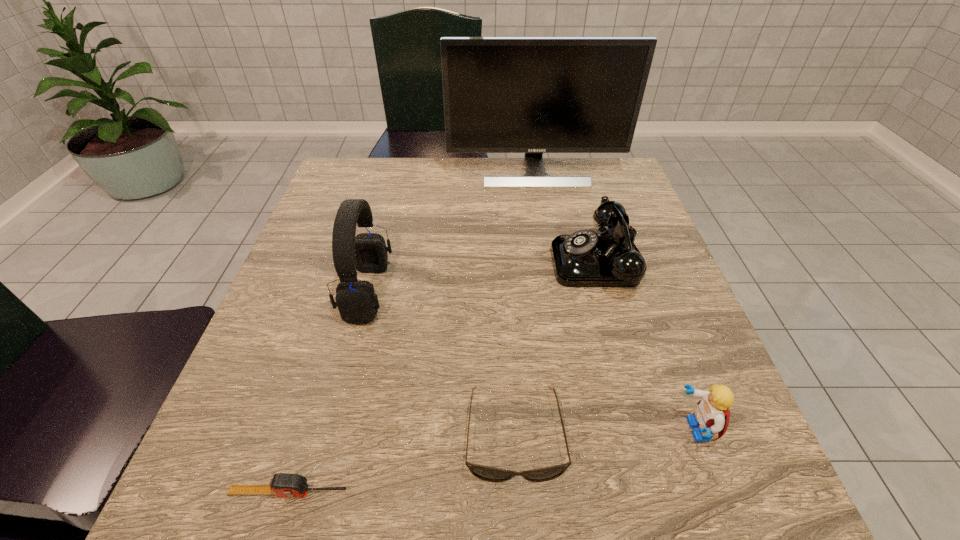
This screenshot has height=540, width=960. I want to click on tape measure that is at the left edge, so click(282, 484).

The height and width of the screenshot is (540, 960). I want to click on monitor present at the right edge, so click(x=533, y=95).

The image size is (960, 540). Identify the location of telephone that is at the right edge. (585, 258).

This screenshot has height=540, width=960. I want to click on Lego that is positioned at the right edge, so click(x=711, y=415).

This screenshot has height=540, width=960. I want to click on object that is at the near left corner, so [282, 484].

At what (x,y) coordinates should I click in order to perform the action: click on object present at the far right corner. Please return your answer as a coordinate pair (x, y). The image size is (960, 540). Looking at the image, I should click on (533, 95).

In order to click on vacant region at the far edge in this screenshot , I will do `click(388, 199)`.

At what (x,y) coordinates should I click in order to perform the action: click on free region at the left edge. Please return your answer as a coordinate pair (x, y). Looking at the image, I should click on (331, 215).

Find the location of a particular element. This screenshot has height=540, width=960. free region at the right edge is located at coordinates (656, 238).

Find the location of `vacant area at the far left corner of the desktop`. vacant area at the far left corner of the desktop is located at coordinates (379, 165).